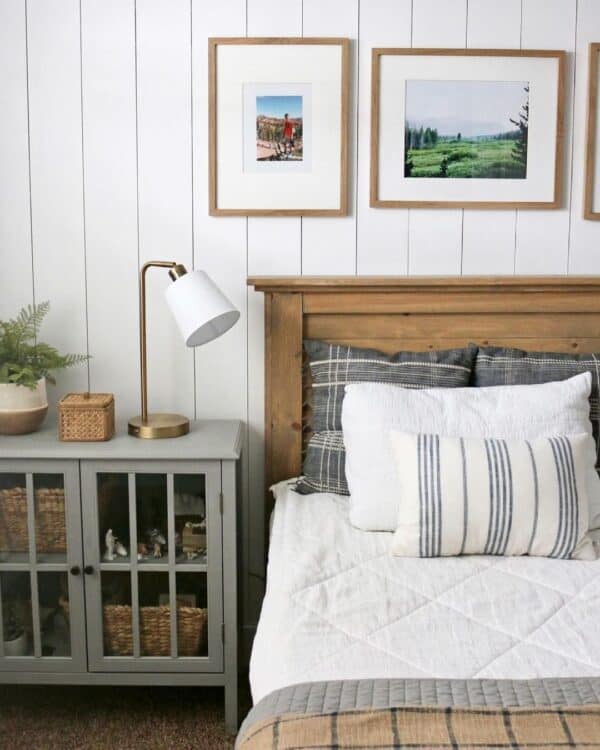
Where is `wall`? wall is located at coordinates (97, 147).